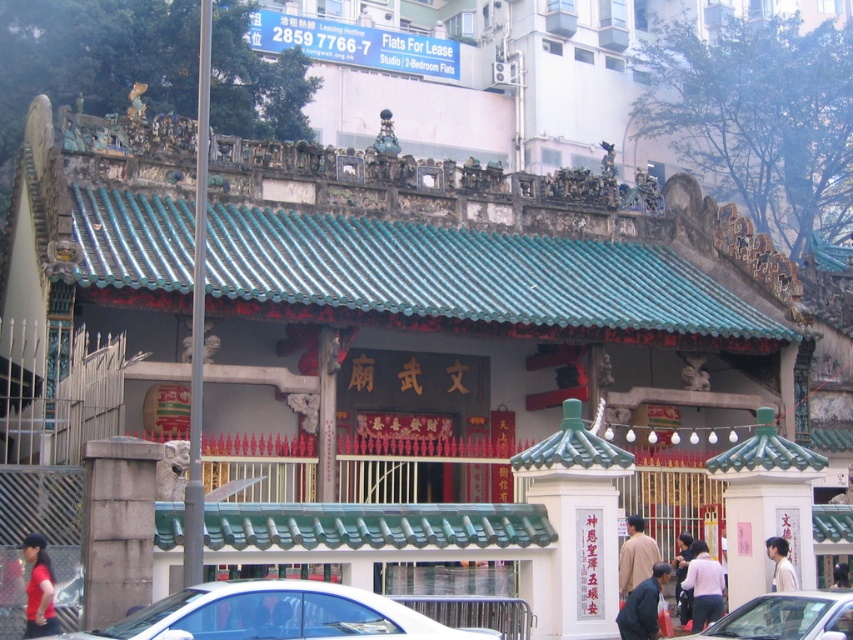
In the scene shown: You are a visitor standing at the entrance of the temple. You need to place a small offering at the base of the gray concrete pillar at left, but you also have a dark blue fabric jacket at lower center that you want to keep dry. The temple is expecting rain. Which object should you prioritize moving to avoid getting wet, and why?

You should prioritize moving the dark blue fabric jacket at lower center because it is closer to you at 43.87 feet away from the gray concrete pillar at left, making it more vulnerable to rain.

You are a photographer standing in front of the temple entrance. You want to take a photo that includes both the dark blue fabric jacket at lower center and the light brown hair at center. Which object should you focus on first to ensure both are in the frame?

You should focus on the dark blue fabric jacket at lower center first because it occupies less space than the light brown hair at center, so it can be positioned within the frame more easily while still including the larger light brown hair at center.